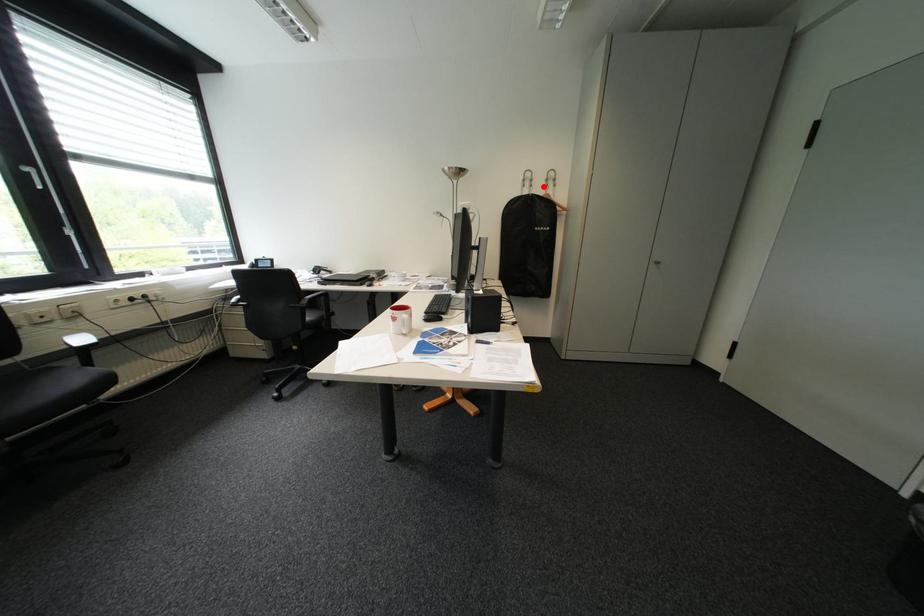
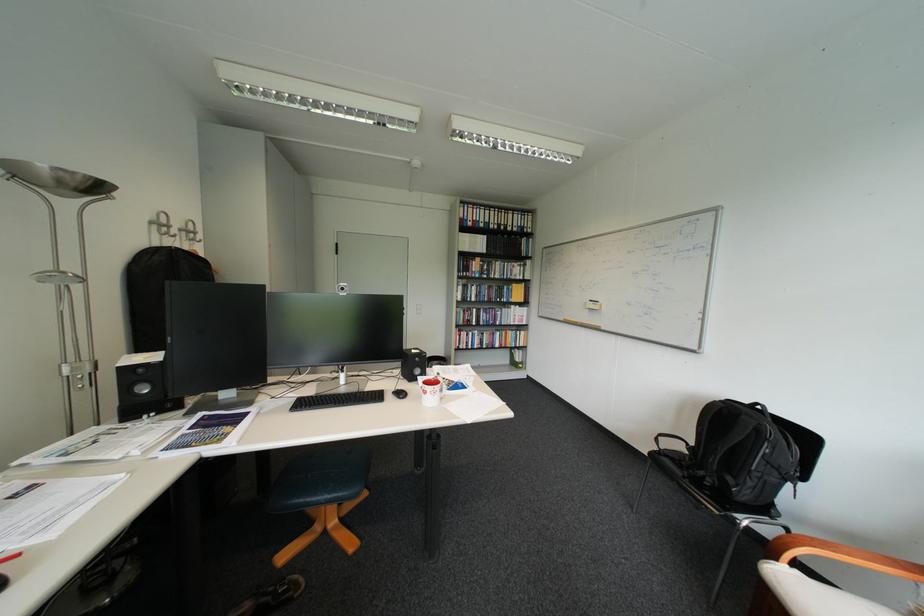
Question: I am providing you with two images of the same scene from different viewpoints. In image1, a red point is highlighted. Considering the same 3D point in image2, which of the following is correct?

Choices:
 (A) It is closer
 (B) It is farther

Answer: (B)